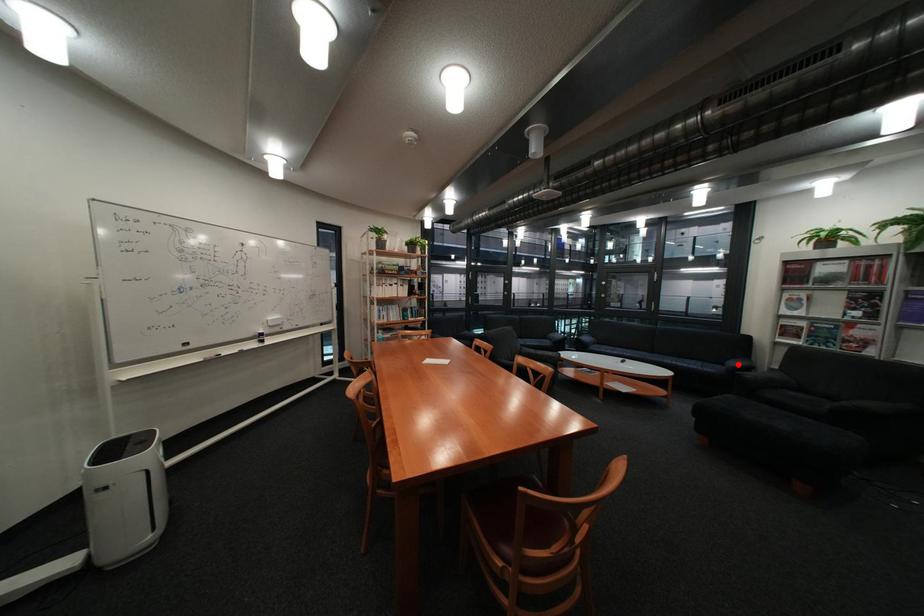
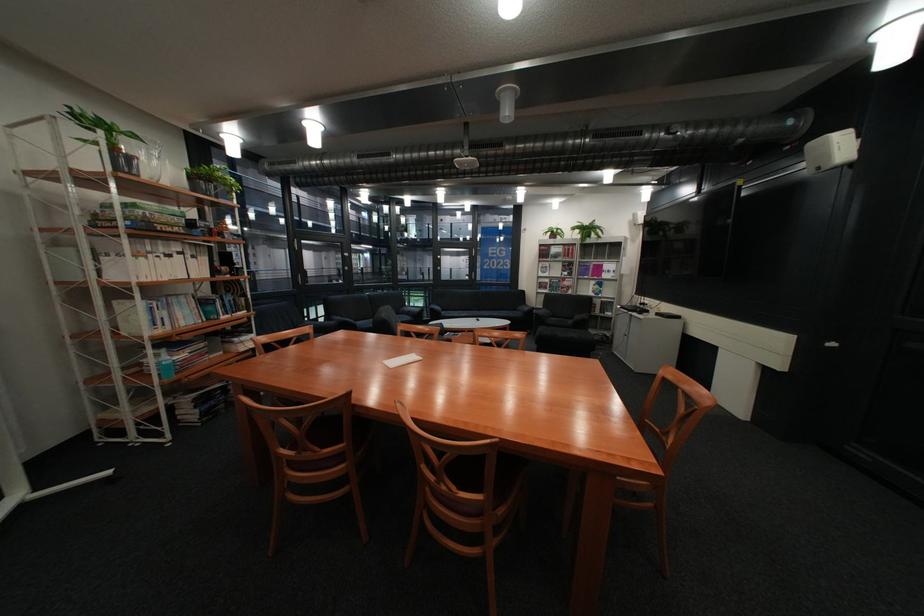
Find the pixel in the second image that matches the highlighted location in the first image.

(531, 310)